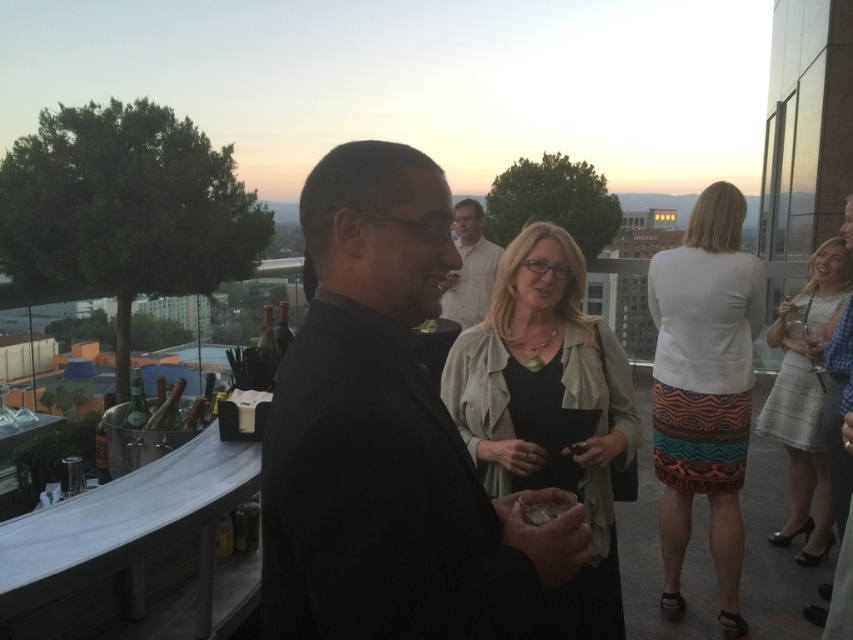
You are at the center of the rooftop and want to find the white matte skirt at upper right. Which direction should you look to locate it?

To locate the white matte skirt at upper right, you should look towards the upper right direction from your current position at the center of the rooftop.

Consider the image. You are a photographer at this rooftop event. You want to capture a photo where both the black matte suit at center and the white matte skirt at upper right are visible. Which object should be placed closer to the bottom of the frame to ensure both are fully visible?

The black matte suit at center is shorter than the white matte skirt at upper right, so placing the black matte suit at center closer to the bottom of the frame will ensure both are fully visible.

You are a photographer at the rooftop event and want to capture both the light gray textured skirt at right and the white cotton shirt at center in a single frame. Which object should you focus on first to ensure both are in the frame?

The light gray textured skirt at right is taller than the white cotton shirt at center, so you should focus on the light gray textured skirt at right first to ensure both are in the frame.